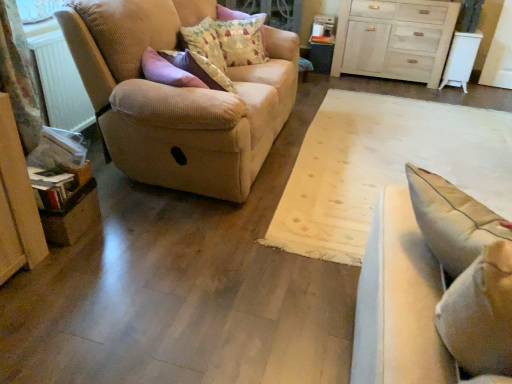
Question: Is patterned fabric pillow at upper center, which is the 2th pillow in front-to-back order, smaller than white plastic radiator at left?

Choices:
 (A) no
 (B) yes

Answer: (A)

Question: Is patterned fabric pillow at upper center, which is the 2th pillow in front-to-back order, not within white plastic radiator at left?

Choices:
 (A) no
 (B) yes

Answer: (B)

Question: Is patterned fabric pillow at upper center, which is the 2th pillow in front-to-back order, to the right of white plastic radiator at left from the viewer's perspective?

Choices:
 (A) yes
 (B) no

Answer: (A)

Question: Can white plastic radiator at left be found inside patterned fabric pillow at upper center, which is the 2th pillow in front-to-back order?

Choices:
 (A) no
 (B) yes

Answer: (A)

Question: From a real-world perspective, is patterned fabric pillow at upper center, which is the 2th pillow in front-to-back order, on white plastic radiator at left?

Choices:
 (A) yes
 (B) no

Answer: (A)

Question: Is patterned fabric pillow at upper center, marked as the first pillow in a back-to-front arrangement, taller than white plastic radiator at left?

Choices:
 (A) no
 (B) yes

Answer: (A)

Question: Is light beige fabric studio couch at right, positioned as the 2th studio couch in back-to-front order, oriented away from white plastic radiator at left?

Choices:
 (A) no
 (B) yes

Answer: (A)

Question: Is light beige fabric studio couch at right, which is counted as the first studio couch, starting from the right, wider than white plastic radiator at left?

Choices:
 (A) no
 (B) yes

Answer: (B)

Question: Considering the relative positions of light beige fabric studio couch at right, positioned as the 2th studio couch in back-to-front order, and white plastic radiator at left in the image provided, is light beige fabric studio couch at right, positioned as the 2th studio couch in back-to-front order, to the right of white plastic radiator at left from the viewer's perspective?

Choices:
 (A) no
 (B) yes

Answer: (B)

Question: Is light beige fabric studio couch at right, acting as the first studio couch starting from the front, oriented towards white plastic radiator at left?

Choices:
 (A) no
 (B) yes

Answer: (A)

Question: Is light beige fabric studio couch at right, acting as the first studio couch starting from the front, bigger than white plastic radiator at left?

Choices:
 (A) no
 (B) yes

Answer: (B)

Question: Would you say light beige fabric studio couch at right, positioned as the 2th studio couch in back-to-front order, is outside white plastic radiator at left?

Choices:
 (A) yes
 (B) no

Answer: (A)

Question: Is the position of fluffy cotton pillow at upper center, placed as the 2th pillow when sorted from back to front, less distant than that of beige corduroy couch at left, which appears as the first studio couch when viewed from the left?

Choices:
 (A) no
 (B) yes

Answer: (A)